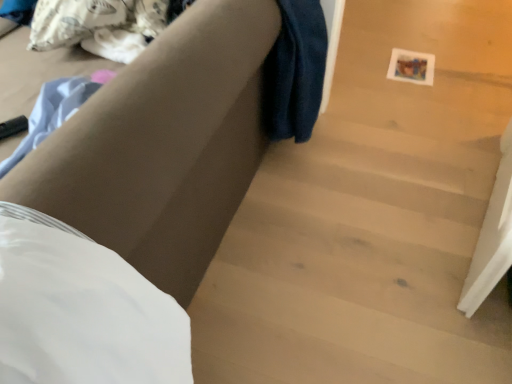
Question: Does matte brown couch at center have a greater width compared to wooden stairs at center?

Choices:
 (A) no
 (B) yes

Answer: (A)

Question: Is matte brown couch at center smaller than wooden stairs at center?

Choices:
 (A) yes
 (B) no

Answer: (B)

Question: Does matte brown couch at center appear on the left side of wooden stairs at center?

Choices:
 (A) yes
 (B) no

Answer: (A)

Question: Can you confirm if matte brown couch at center is thinner than wooden stairs at center?

Choices:
 (A) no
 (B) yes

Answer: (B)

Question: Considering the relative sizes of matte brown couch at center and wooden stairs at center in the image provided, is matte brown couch at center taller than wooden stairs at center?

Choices:
 (A) yes
 (B) no

Answer: (A)

Question: Is the position of matte brown couch at center more distant than that of wooden stairs at center?

Choices:
 (A) yes
 (B) no

Answer: (B)

Question: Is white matte sheet at lower left facing away from matte brown couch at center?

Choices:
 (A) no
 (B) yes

Answer: (B)

Question: Could you tell me if white matte sheet at lower left is facing matte brown couch at center?

Choices:
 (A) yes
 (B) no

Answer: (A)

Question: Considering the relative sizes of white matte sheet at lower left and matte brown couch at center in the image provided, is white matte sheet at lower left thinner than matte brown couch at center?

Choices:
 (A) no
 (B) yes

Answer: (B)

Question: Is white matte sheet at lower left to the left of matte brown couch at center from the viewer's perspective?

Choices:
 (A) no
 (B) yes

Answer: (A)

Question: From the image's perspective, is white matte sheet at lower left below matte brown couch at center?

Choices:
 (A) no
 (B) yes

Answer: (B)

Question: Does white matte sheet at lower left have a larger size compared to matte brown couch at center?

Choices:
 (A) yes
 (B) no

Answer: (B)

Question: Can you confirm if white matte sheet at lower left is bigger than wooden stairs at center?

Choices:
 (A) yes
 (B) no

Answer: (A)